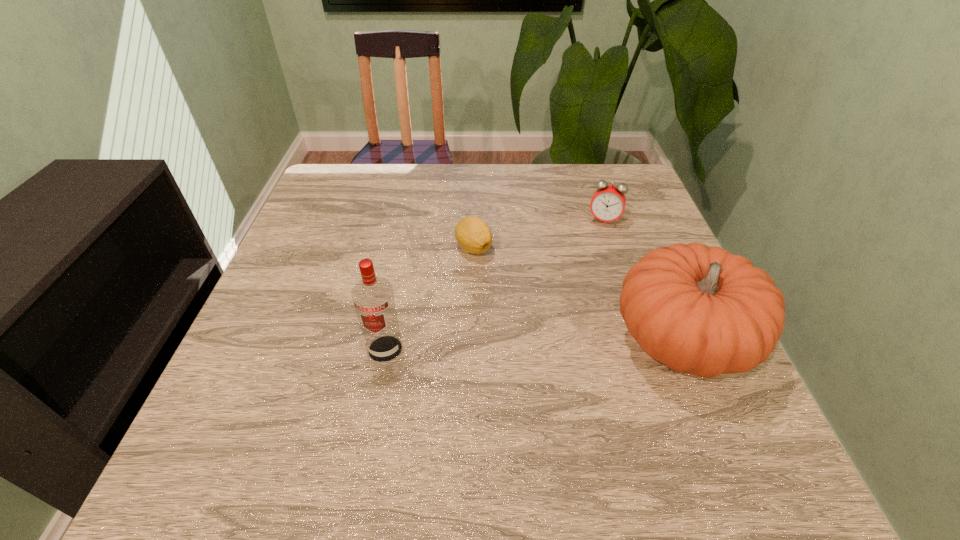
At what (x,y) coordinates should I click in order to perform the action: click on vodka. Please return your answer as a coordinate pair (x, y). Looking at the image, I should click on (373, 297).

At what (x,y) coordinates should I click in order to perform the action: click on the tallest object. Please return your answer as a coordinate pair (x, y). Looking at the image, I should click on (373, 297).

In order to click on pumpkin in this screenshot , I will do pyautogui.click(x=699, y=310).

At what (x,y) coordinates should I click in order to perform the action: click on the shortest object. Please return your answer as a coordinate pair (x, y). Looking at the image, I should click on (474, 236).

The width and height of the screenshot is (960, 540). I want to click on the third object from right to left, so click(474, 236).

You are a GUI agent. You are given a task and a screenshot of the screen. Output one action in this format:
    pyautogui.click(x=<x>, y=<y>)
    Task: Click on the alarm clock
    
    Given the screenshot: What is the action you would take?
    pyautogui.click(x=608, y=202)

The height and width of the screenshot is (540, 960). Identify the location of the farthest object. (608, 202).

Find the location of a particular element. free space located 0.060m on the front label of the vodka is located at coordinates (377, 393).

I want to click on vacant space located on the back of the pumpkin, so click(x=633, y=219).

Where is `vacant space located 0.400m at the stem end of the third object from right to left`? vacant space located 0.400m at the stem end of the third object from right to left is located at coordinates (515, 419).